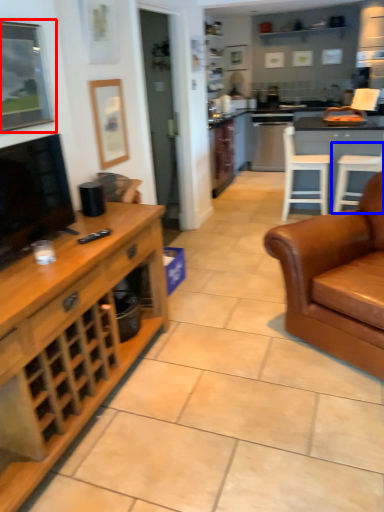
Question: Which object is further to the camera taking this photo, picture frame (highlighted by a red box) or chair (highlighted by a blue box)?

Choices:
 (A) picture frame
 (B) chair

Answer: (B)